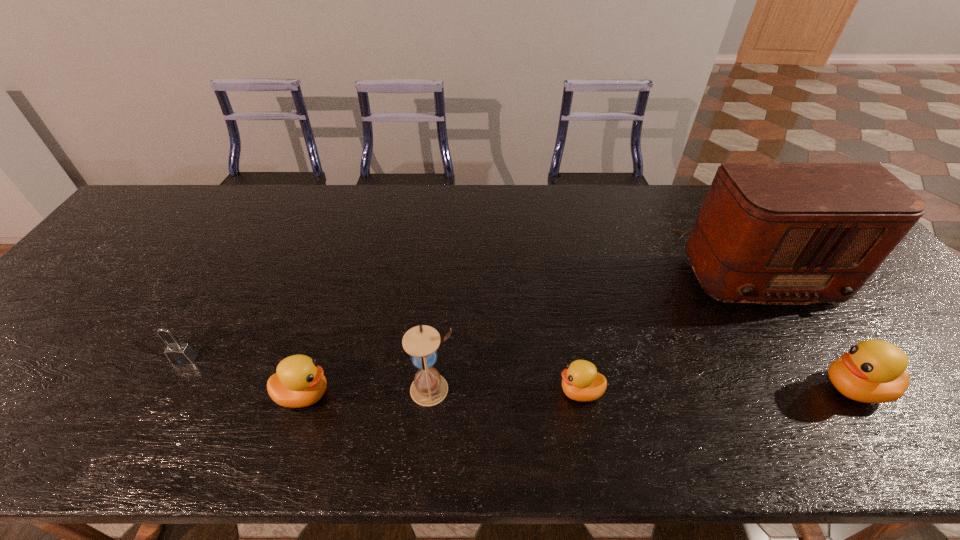
Where is `hourglass`? The width and height of the screenshot is (960, 540). hourglass is located at coordinates (429, 388).

Find the location of a particular element. The width and height of the screenshot is (960, 540). the third object from left to right is located at coordinates click(x=429, y=388).

Where is `free space located 0.310m on the face of the second tallest duckling`? free space located 0.310m on the face of the second tallest duckling is located at coordinates (474, 395).

Where is `vacant space situated on the face of the second duckling from left to right`? The width and height of the screenshot is (960, 540). vacant space situated on the face of the second duckling from left to right is located at coordinates (490, 392).

You are a GUI agent. You are given a task and a screenshot of the screen. Output one action in this format:
    pyautogui.click(x=<x>, y=<y>)
    Task: Click on the free space located on the face of the second duckling from left to right
    This screenshot has height=540, width=960.
    Given the screenshot: What is the action you would take?
    pyautogui.click(x=435, y=392)

At what (x,y) coordinates should I click in order to perform the action: click on vacant area located 0.180m on the face of the second duckling from left to right. Please return your answer as a coordinate pair (x, y). This screenshot has width=960, height=540. Looking at the image, I should click on click(x=476, y=392).

Identify the location of blank space located on the face of the tallest duckling. The image size is (960, 540). (766, 388).

You are a GUI agent. You are given a task and a screenshot of the screen. Output one action in this format:
    pyautogui.click(x=<x>, y=<y>)
    Task: Click on the free space located 0.350m on the face of the tallest duckling
    The height and width of the screenshot is (540, 960).
    Given the screenshot: What is the action you would take?
    tap(661, 388)

You are a GUI agent. You are given a task and a screenshot of the screen. Output one action in this format:
    pyautogui.click(x=<x>, y=<y>)
    Task: Click on the vacant space located on the face of the tallest duckling
    This screenshot has height=540, width=960.
    Given the screenshot: What is the action you would take?
    (x=658, y=388)

Locate an element on the screen. vacant space located 0.090m on the shackle of the padlock is located at coordinates (161, 400).